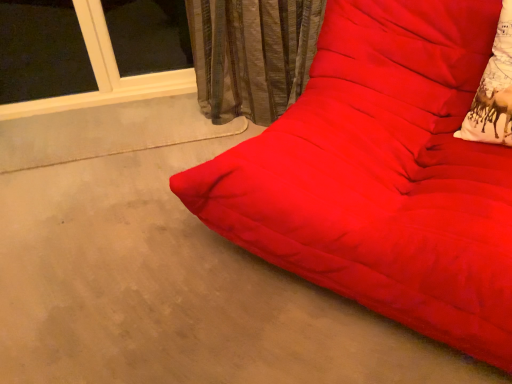
Question: Is white printed fabric at right wider or thinner than matte red futon at center?

Choices:
 (A) wide
 (B) thin

Answer: (B)

Question: Is point (493, 74) closer or farther from the camera than point (328, 183)?

Choices:
 (A) farther
 (B) closer

Answer: (A)

Question: Is white printed fabric at right bigger or smaller than matte red futon at center?

Choices:
 (A) small
 (B) big

Answer: (A)

Question: From a real-world perspective, is matte red futon at center above or below white printed fabric at right?

Choices:
 (A) below
 (B) above

Answer: (A)

Question: Is matte red futon at center bigger or smaller than white printed fabric at right?

Choices:
 (A) big
 (B) small

Answer: (A)

Question: Is matte red futon at center in front of or behind white printed fabric at right in the image?

Choices:
 (A) behind
 (B) front

Answer: (B)

Question: Is matte red futon at center wider or thinner than white printed fabric at right?

Choices:
 (A) thin
 (B) wide

Answer: (B)